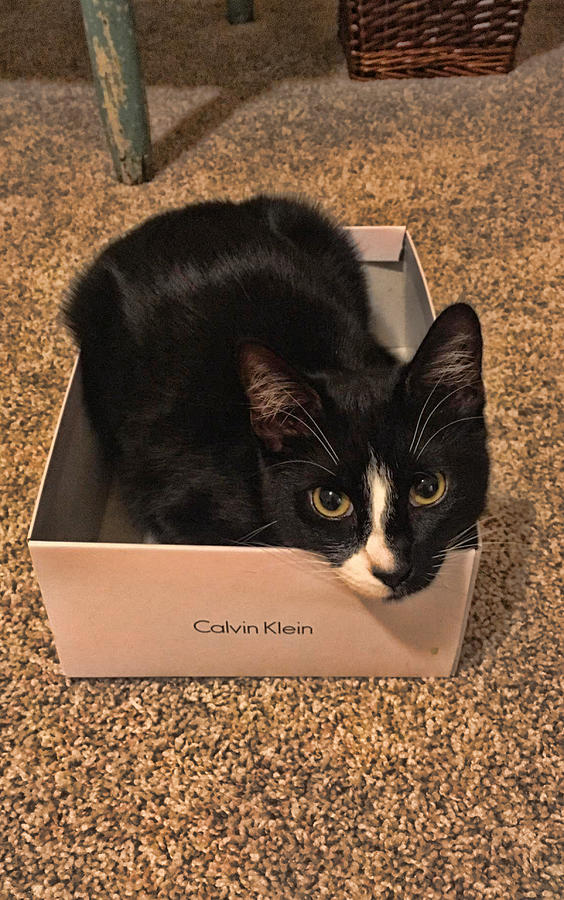
You are a GUI agent. You are given a task and a screenshot of the screen. Output one action in this format:
    pyautogui.click(x=<x>, y=<y>)
    Task: Click on the carpet behind box
    This screenshot has width=564, height=900.
    Given the screenshot: What is the action you would take?
    pyautogui.click(x=272, y=137)